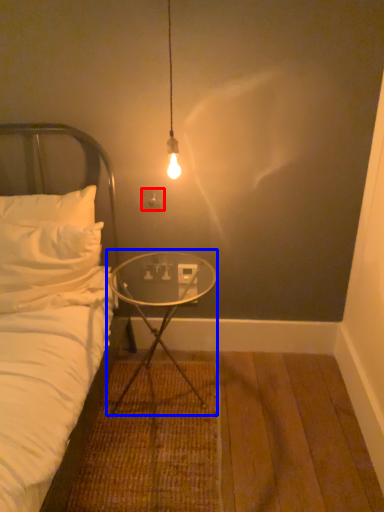
Question: Which of the following is the farthest to the observer, electric outlet (highlighted by a red box) or table (highlighted by a blue box)?

Choices:
 (A) electric outlet
 (B) table

Answer: (A)